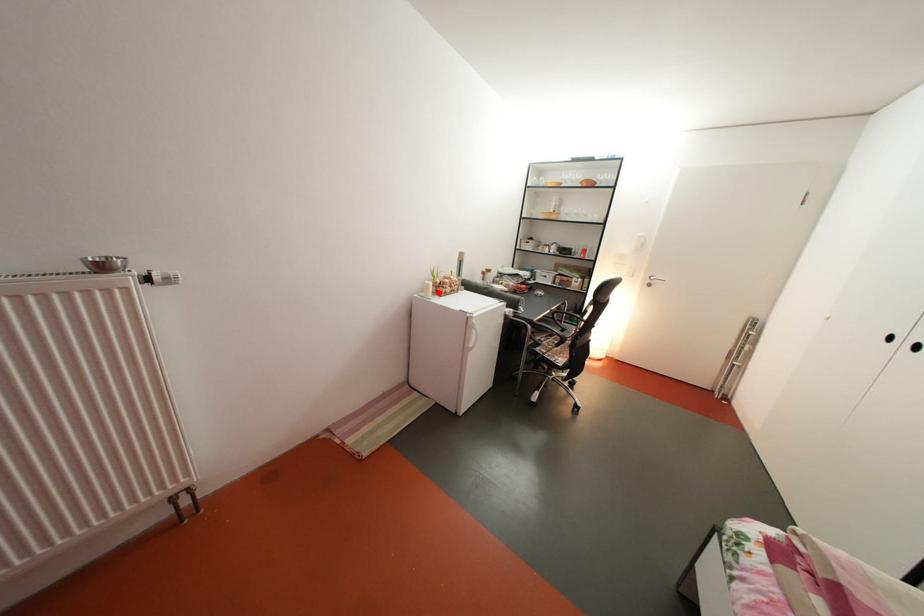
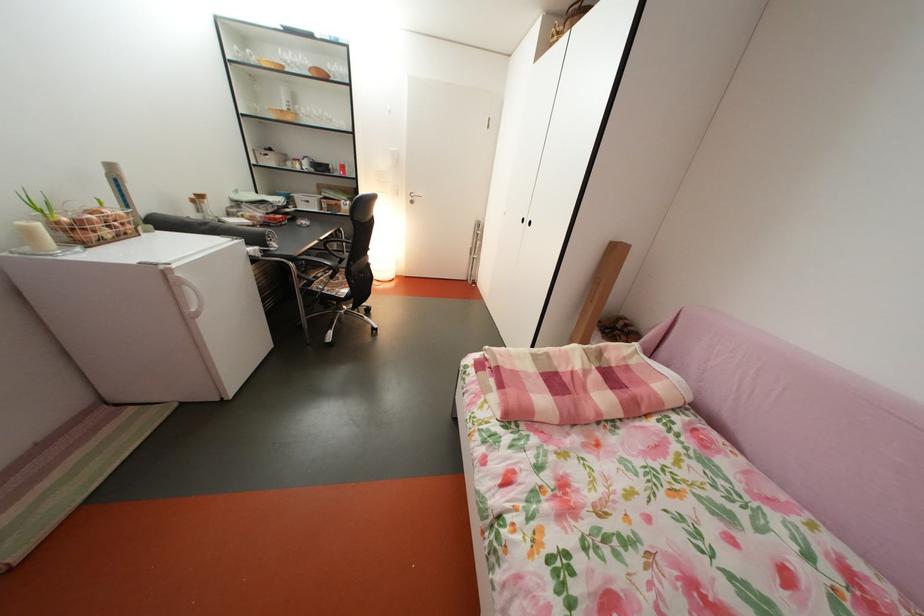
Question: A red point is marked in image1. In image2, is the corresponding 3D point closer to the camera or farther? Reply with the corresponding letter.

Choices:
 (A) The corresponding 3D point is closer.
 (B) The corresponding 3D point is farther.

Answer: (B)